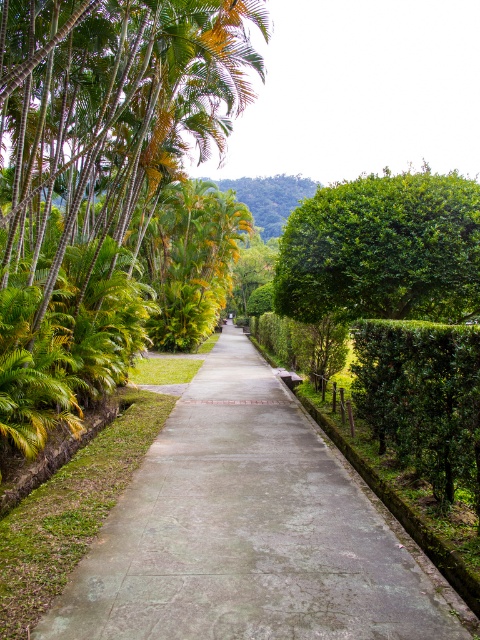
Is green leafy bush at center right below green leafy hedge at right?

No.

In the scene shown: Which of these two, green leafy bush at center right or green leafy hedge at right, stands shorter?

green leafy hedge at right

Image resolution: width=480 pixels, height=640 pixels. What do you see at coordinates (383, 250) in the screenshot? I see `green leafy bush at center right` at bounding box center [383, 250].

Find the location of a particular element. The height and width of the screenshot is (640, 480). green leafy bush at center right is located at coordinates (383, 250).

Does green concrete pavement at center appear under green leafy bush at center right?

Yes, green concrete pavement at center is below green leafy bush at center right.

Can you confirm if green concrete pavement at center is smaller than green leafy bush at center right?

Yes, green concrete pavement at center is smaller than green leafy bush at center right.

Between point (332, 458) and point (326, 285), which one is positioned behind?

Point (326, 285)

Image resolution: width=480 pixels, height=640 pixels. Find the location of `green concrete pavement at center`. green concrete pavement at center is located at coordinates (244, 531).

Does green concrete pavement at center have a greater width compared to green leafy hedge at right?

Yes.

Based on the photo, can you confirm if green concrete pavement at center is positioned to the right of green leafy hedge at right?

In fact, green concrete pavement at center is to the left of green leafy hedge at right.

Does point (264, 468) come farther from viewer compared to point (443, 394)?

Yes, point (264, 468) is behind point (443, 394).

Identify the location of green concrete pavement at center. (244, 531).